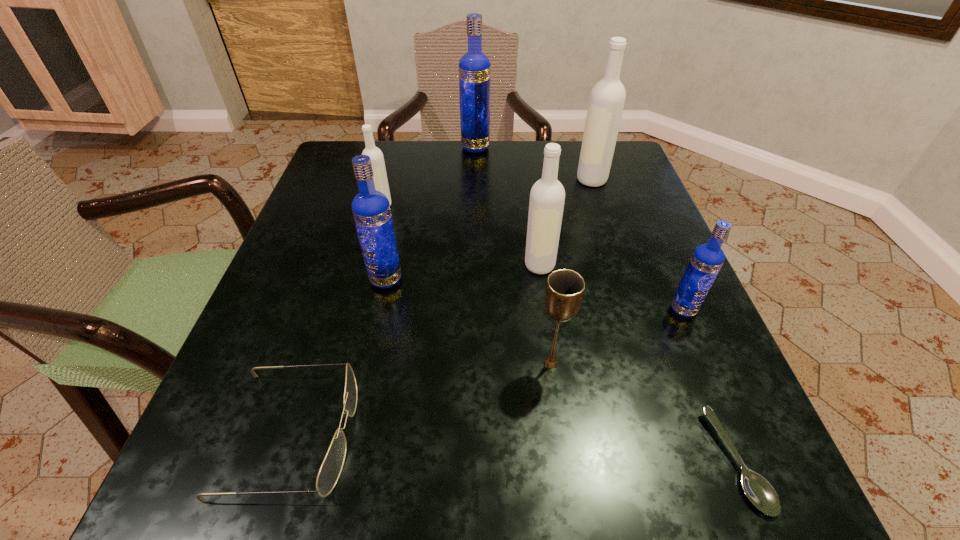
The image size is (960, 540). In order to click on free space between the chalice and the nearest white vodka in this screenshot , I will do `click(545, 314)`.

Find the location of a particular element. This screenshot has height=540, width=960. vacant region between the biggest blue vodka and the eighth tallest object is located at coordinates (383, 291).

You are a GUI agent. You are given a task and a screenshot of the screen. Output one action in this format:
    pyautogui.click(x=<x>, y=<y>)
    Task: Click on the empty location between the second smallest white vodka and the third nearest object
    
    Given the screenshot: What is the action you would take?
    pyautogui.click(x=545, y=314)

Where is `vacant area between the farthest vodka and the second shortest object`? vacant area between the farthest vodka and the second shortest object is located at coordinates (383, 291).

Image resolution: width=960 pixels, height=540 pixels. In order to click on free point between the second white vodka from right to left and the leftmost blue vodka in this screenshot , I will do `click(463, 272)`.

You are a GUI agent. You are given a task and a screenshot of the screen. Output one action in this format:
    pyautogui.click(x=<x>, y=<y>)
    Task: Click on the empty location between the rightmost blue vodka and the shortest object
    
    Given the screenshot: What is the action you would take?
    pyautogui.click(x=710, y=385)

Find the location of a particular element. empty space that is in between the nearest white vodka and the spectacles is located at coordinates (416, 349).

Find the location of `object that is the seventh closest to the second biggest blue vodka`. object that is the seventh closest to the second biggest blue vodka is located at coordinates (707, 259).

Point out which object is positioned as the third nearest to the nearest white vodka. Please provide its 2D coordinates. Your answer should be formatted as a tuple, i.e. [(x, y)], where the tuple contains the x and y coordinates of a point satisfying the conditions above.

[(371, 210)]

Where is `vodka identified as the third closest to the smallest white vodka`? vodka identified as the third closest to the smallest white vodka is located at coordinates (547, 196).